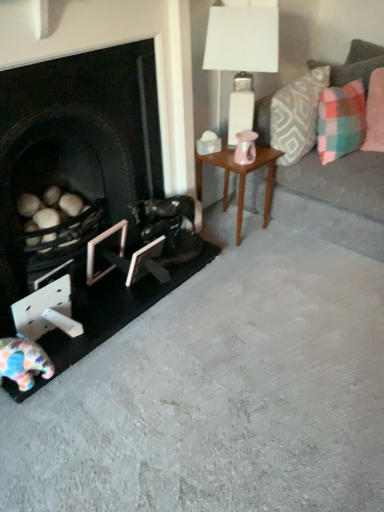
Question: Should I look upward or downward to see wooden side table at center?

Choices:
 (A) up
 (B) down

Answer: (A)

Question: Considering the relative sizes of white matte picture frame at lower center, the 2th picture frame viewed from the left, and pink fabric pillow at upper right, which is the 3th pillow from left to right, in the image provided, is white matte picture frame at lower center, the 2th picture frame viewed from the left, taller than pink fabric pillow at upper right, which is the 3th pillow from left to right,?

Choices:
 (A) yes
 (B) no

Answer: (B)

Question: Considering the relative sizes of white matte picture frame at lower center, which is counted as the 1th picture frame, starting from the right, and pink fabric pillow at upper right, which is counted as the 1th pillow, starting from the right, in the image provided, is white matte picture frame at lower center, which is counted as the 1th picture frame, starting from the right, thinner than pink fabric pillow at upper right, which is counted as the 1th pillow, starting from the right,?

Choices:
 (A) yes
 (B) no

Answer: (A)

Question: Can you confirm if white matte picture frame at lower center, which is counted as the 1th picture frame, starting from the right, is positioned to the left of pink fabric pillow at upper right, which is counted as the 1th pillow, starting from the right?

Choices:
 (A) yes
 (B) no

Answer: (A)

Question: From a real-world perspective, is white matte picture frame at lower center, which is counted as the 1th picture frame, starting from the right, positioned under pink fabric pillow at upper right, which is counted as the 1th pillow, starting from the right, based on gravity?

Choices:
 (A) no
 (B) yes

Answer: (B)

Question: Considering the relative sizes of white matte picture frame at lower center, the 2th picture frame viewed from the left, and pink fabric pillow at upper right, which is counted as the 1th pillow, starting from the right, in the image provided, is white matte picture frame at lower center, the 2th picture frame viewed from the left, wider than pink fabric pillow at upper right, which is counted as the 1th pillow, starting from the right,?

Choices:
 (A) no
 (B) yes

Answer: (A)

Question: Does white matte picture frame at lower center, the 2th picture frame viewed from the left, appear on the right side of pink fabric pillow at upper right, which is counted as the 1th pillow, starting from the right?

Choices:
 (A) yes
 (B) no

Answer: (B)

Question: Can you confirm if plaid fabric pillow at upper right, acting as the second pillow starting from the left, is wider than pink fabric pillow at upper right, which is the 3th pillow from left to right?

Choices:
 (A) no
 (B) yes

Answer: (B)

Question: Can you confirm if plaid fabric pillow at upper right, the second pillow from the right, is shorter than pink fabric pillow at upper right, which is the 3th pillow from left to right?

Choices:
 (A) no
 (B) yes

Answer: (B)

Question: Is the surface of plaid fabric pillow at upper right, the second pillow from the right, in direct contact with pink fabric pillow at upper right, which is counted as the 1th pillow, starting from the right?

Choices:
 (A) yes
 (B) no

Answer: (B)

Question: Is plaid fabric pillow at upper right, acting as the second pillow starting from the left, to the right of pink fabric pillow at upper right, which is counted as the 1th pillow, starting from the right, from the viewer's perspective?

Choices:
 (A) yes
 (B) no

Answer: (B)

Question: Is pink fabric pillow at upper right, which is the 3th pillow from left to right, a part of plaid fabric pillow at upper right, acting as the second pillow starting from the left?

Choices:
 (A) yes
 (B) no

Answer: (B)

Question: Is plaid fabric pillow at upper right, acting as the second pillow starting from the left, not inside pink fabric pillow at upper right, which is the 3th pillow from left to right?

Choices:
 (A) yes
 (B) no

Answer: (A)

Question: Is pink fabric pillow at upper right, which is counted as the 1th pillow, starting from the right, facing away from wooden side table at center?

Choices:
 (A) no
 (B) yes

Answer: (A)